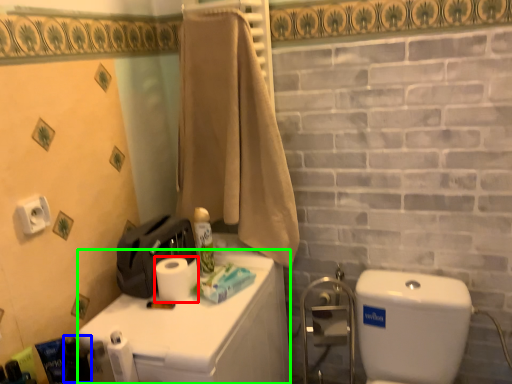
Question: Which object is the farthest from toilet paper (highlighted by a red box)? Choose among these: toiletry (highlighted by a blue box) or counter top (highlighted by a green box).

Choices:
 (A) toiletry
 (B) counter top

Answer: (A)